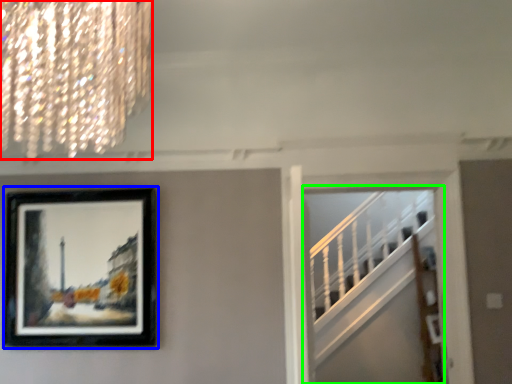
Question: Which object is positioned closest to lamp (highlighted by a red box)? Select from picture frame (highlighted by a blue box) and escalator (highlighted by a green box).

Choices:
 (A) picture frame
 (B) escalator

Answer: (A)